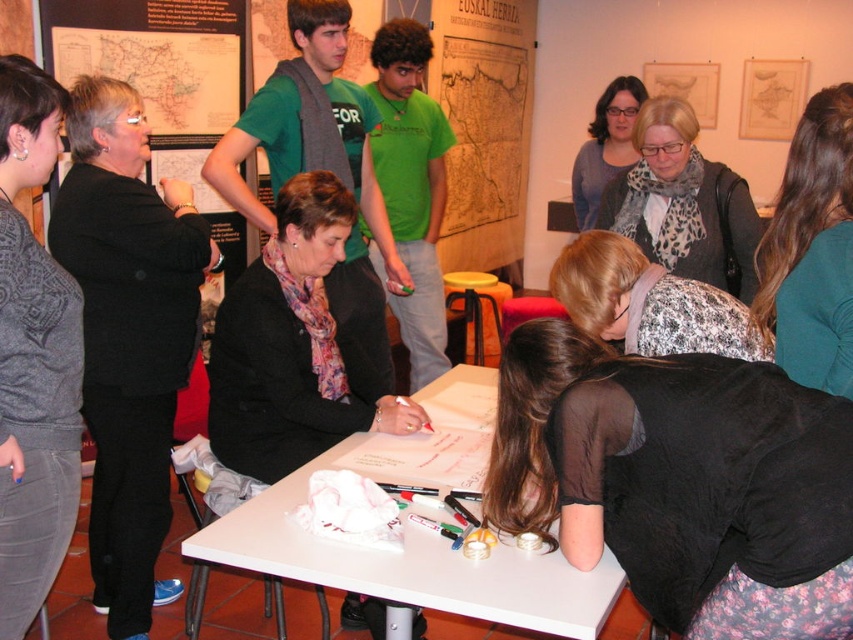
You are organizing a photo shoot and need to ensure that all participants are visible in the frame. Given that the teal sweater at lower right and the leopard print scarf at center are part of the group, which item would you focus on to ensure both are captured clearly?

Since the teal sweater at lower right is smaller than the leopard print scarf at center, you should focus on positioning the camera to ensure the smaller teal sweater at lower right is within the frame while also capturing the larger leopard print scarf at center.

You are standing in the room and notice two items of clothing on the people at the table. The gray textured sweater at left and the leopard print scarf at center. Which one is nearer to you?

The gray textured sweater at left is closer to the viewer than the leopard print scarf at center.